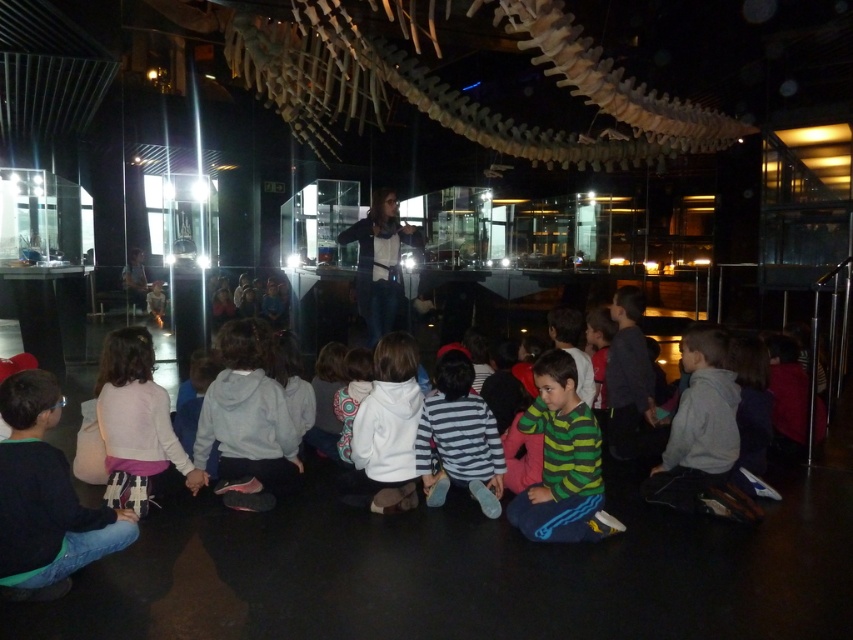
Question: Estimate the real-world distances between objects in this image. Which object is closer to the white fleece jacket at center?

Choices:
 (A) striped cotton shirt at center
 (B) bone-like structure at upper center
 (C) gray hoodie at lower right
 (D) striped jersey at center

Answer: (A)

Question: Is bone-like structure at upper center to the left of striped cotton shirt at center from the viewer's perspective?

Choices:
 (A) yes
 (B) no

Answer: (A)

Question: Can you confirm if striped cotton shirt at center is positioned below white fleece jacket at center?

Choices:
 (A) yes
 (B) no

Answer: (A)

Question: Which object appears farthest from the camera in this image?

Choices:
 (A) striped cotton shirt at center
 (B) striped jersey at center
 (C) white fleece jacket at center

Answer: (A)

Question: Which point is closer to the camera?

Choices:
 (A) striped cotton shirt at center
 (B) bone-like structure at upper center
 (C) white fleece jacket at center

Answer: (B)

Question: Where is striped cotton shirt at center located in relation to white fleece jacket at center in the image?

Choices:
 (A) right
 (B) left

Answer: (A)